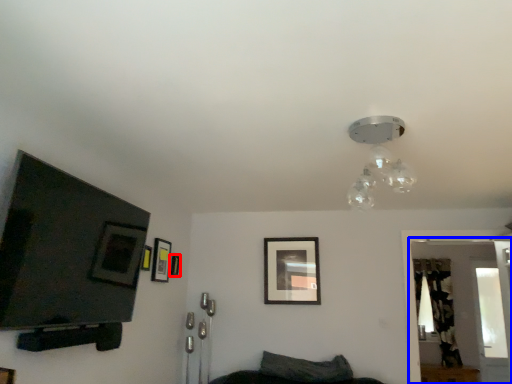
Question: Which object is closer to the camera taking this photo, picture frame (highlighted by a red box) or glass door (highlighted by a blue box)?

Choices:
 (A) picture frame
 (B) glass door

Answer: (B)